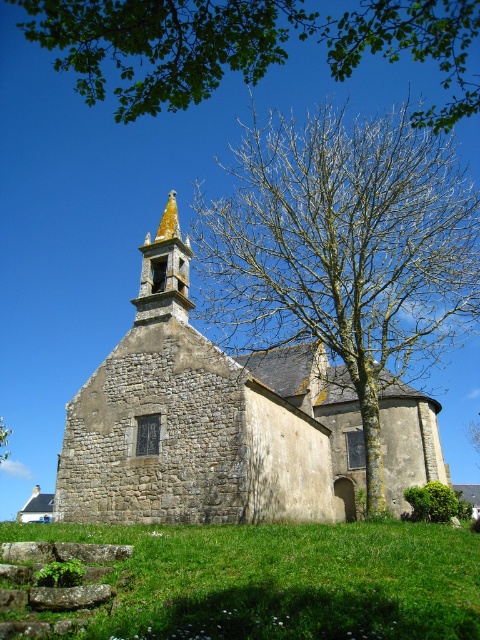
Question: Does bare branches at center appear under golden stone spire at upper center?

Choices:
 (A) no
 (B) yes

Answer: (B)

Question: In this image, where is green leafy tree at upper center located relative to golden stone spire at upper center?

Choices:
 (A) below
 (B) above

Answer: (B)

Question: Which of the following is the closest to the observer?

Choices:
 (A) green leafy tree at upper center
 (B) bare branches at center
 (C) golden stone spire at upper center
 (D) green leafy tree at lower left

Answer: (A)

Question: Which object appears closest to the camera in this image?

Choices:
 (A) green leafy tree at lower left
 (B) green grass at lower center
 (C) green leafy tree at upper center
 (D) golden stone spire at upper center

Answer: (B)

Question: Is green grass at lower center wider than green leafy tree at upper center?

Choices:
 (A) no
 (B) yes

Answer: (A)

Question: Which is nearer to the bare branches at center?

Choices:
 (A) green grass at lower center
 (B) green leafy tree at lower left
 (C) golden stone spire at upper center

Answer: (C)